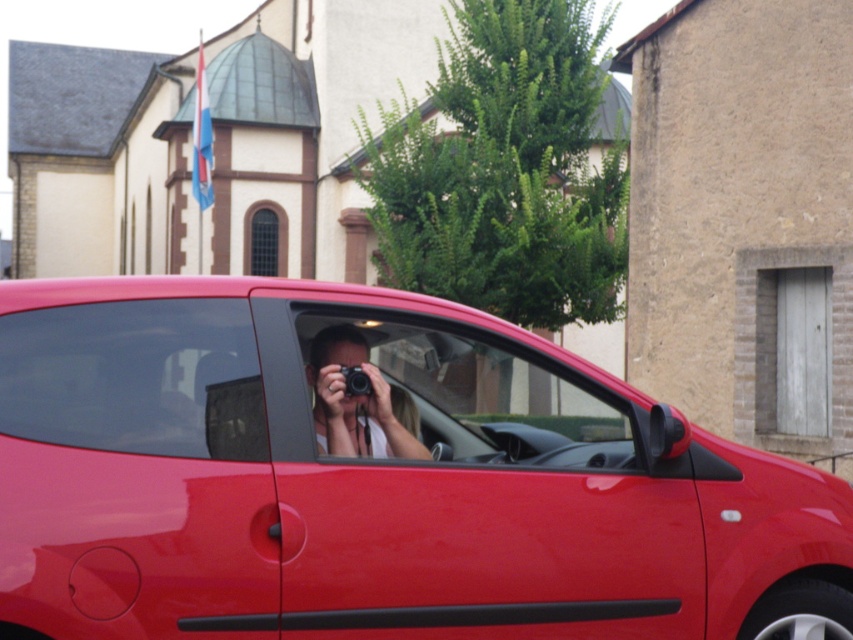
Question: Which of the following is the closest to the observer?

Choices:
 (A) (358, 444)
 (B) (67, 376)
 (C) (316, 364)
 (D) (219, 298)

Answer: (B)

Question: Which point is closer to the camera?

Choices:
 (A) matte black camera at center
 (B) transparent glass at center

Answer: (B)

Question: Is glossy red car at center smaller than matte black camera at center?

Choices:
 (A) yes
 (B) no

Answer: (B)

Question: Which point is closer to the camera?

Choices:
 (A) (28, 385)
 (B) (227, 557)

Answer: (B)

Question: Can you confirm if glossy red car at center is bigger than transparent glass window at center?

Choices:
 (A) no
 (B) yes

Answer: (B)

Question: In this image, where is transparent glass at center located relative to matte black camera at center?

Choices:
 (A) right
 (B) left

Answer: (A)